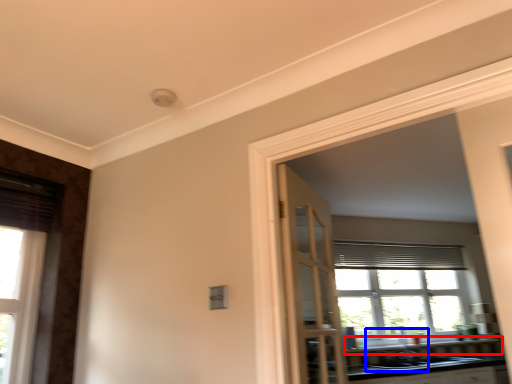
Question: Which object appears closest to the camera in this image, window sill (highlighted by a red box) or sink (highlighted by a blue box)?

Choices:
 (A) window sill
 (B) sink

Answer: (B)